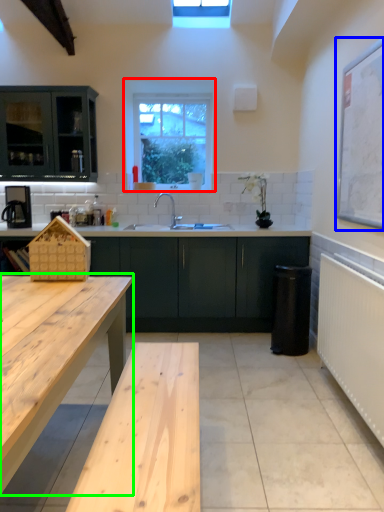
Question: Which object is the farthest from window (highlighted by a red box)? Choose among these: bulletin board (highlighted by a blue box) or table (highlighted by a green box).

Choices:
 (A) bulletin board
 (B) table

Answer: (B)